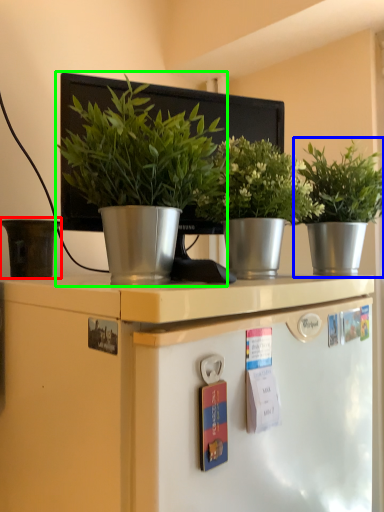
Question: Which is nearer to the flowerpot (highlighted by a red box)? houseplant (highlighted by a blue box) or houseplant (highlighted by a green box).

Choices:
 (A) houseplant
 (B) houseplant

Answer: (B)